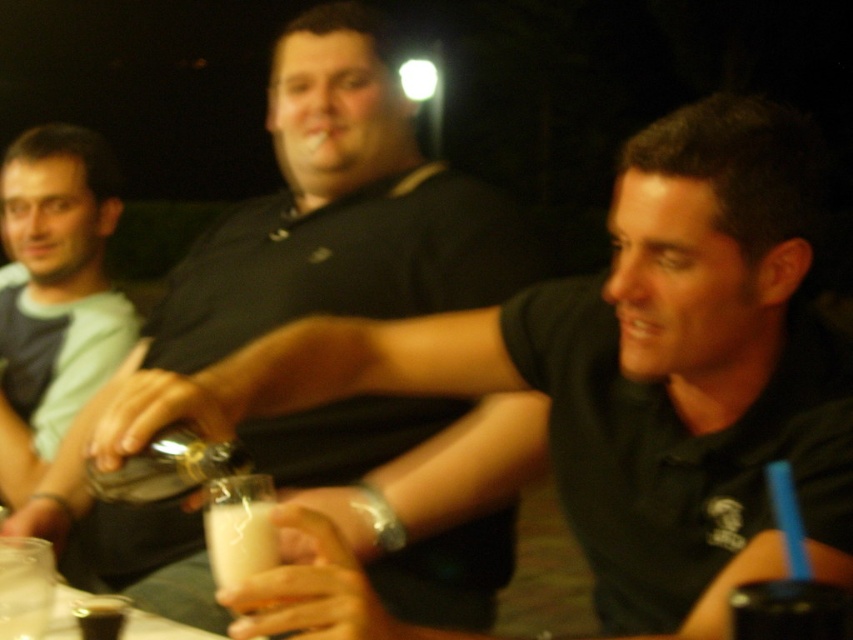
You are a GUI agent. You are given a task and a screenshot of the screen. Output one action in this format:
    pyautogui.click(x=<x>, y=<y>)
    Task: Click on the black plastic cup at lower right
    
    Given the screenshot: What is the action you would take?
    click(790, 611)

Is black plastic cup at lower right taller than white opaque cup at center?

No.

Where is `black plastic cup at lower right`? Image resolution: width=853 pixels, height=640 pixels. black plastic cup at lower right is located at coordinates (790, 611).

The width and height of the screenshot is (853, 640). I want to click on black plastic cup at lower right, so click(790, 611).

Based on the photo, is light blue cotton shirt at left to the left of black plastic cup at lower right from the viewer's perspective?

Correct, you'll find light blue cotton shirt at left to the left of black plastic cup at lower right.

Is light blue cotton shirt at left thinner than black plastic cup at lower right?

Incorrect, light blue cotton shirt at left's width is not less than black plastic cup at lower right's.

At what (x,y) coordinates should I click in order to perform the action: click on light blue cotton shirt at left. Please return your answer as a coordinate pair (x, y). The width and height of the screenshot is (853, 640). Looking at the image, I should click on (54, 292).

Is light blue cotton shirt at left positioned at the back of translucent glass cup at lower left?

Yes, it is behind translucent glass cup at lower left.

Can you confirm if light blue cotton shirt at left is smaller than translucent glass cup at lower left?

No.

Between point (22, 468) and point (90, 621), which one is positioned in front?

Point (90, 621)

Locate an element on the screen. This screenshot has height=640, width=853. light blue cotton shirt at left is located at coordinates (54, 292).